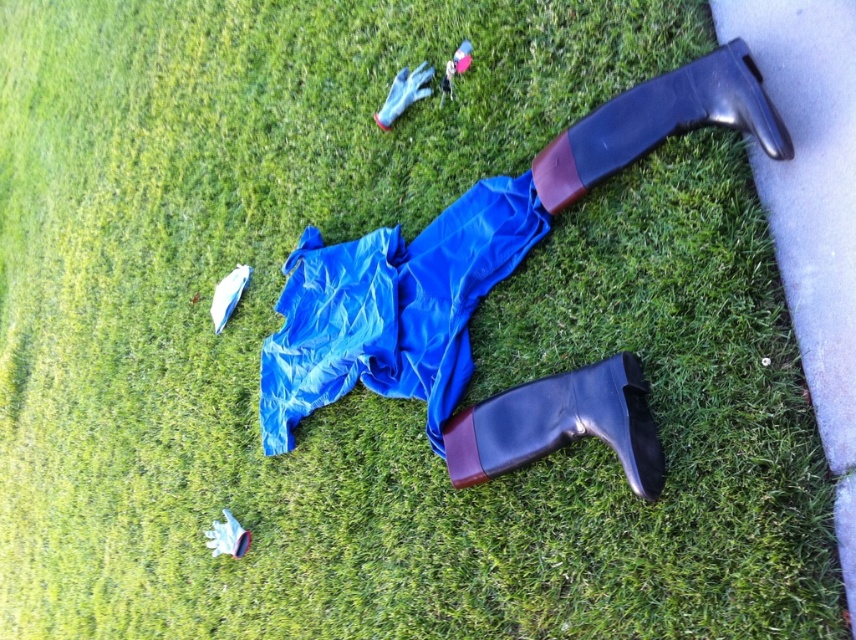
Looking at this image, can you confirm if blue tarp at center is positioned to the right of shiny black boot at lower center?

In fact, blue tarp at center is to the left of shiny black boot at lower center.

Who is higher up, blue tarp at center or shiny black boot at lower center?

blue tarp at center is higher up.

Which is behind, point (431, 416) or point (551, 387)?

The point (431, 416) is more distant.

What are the coordinates of `blue tarp at center` in the screenshot? It's located at (391, 308).

Does shiny black boot at lower center have a lesser width compared to rubber boot at upper right?

Correct, shiny black boot at lower center's width is less than rubber boot at upper right's.

Describe the element at coordinates (559, 424) in the screenshot. The height and width of the screenshot is (640, 856). I see `shiny black boot at lower center` at that location.

Where is `shiny black boot at lower center`? The image size is (856, 640). shiny black boot at lower center is located at coordinates (559, 424).

Who is taller, blue tarp at center or rubber boot at upper right?

blue tarp at center

Who is positioned more to the right, blue tarp at center or rubber boot at upper right?

rubber boot at upper right is more to the right.

Who is more distant from viewer, (290, 349) or (734, 93)?

Positioned behind is point (290, 349).

The height and width of the screenshot is (640, 856). What are the coordinates of `blue tarp at center` in the screenshot? It's located at (391, 308).